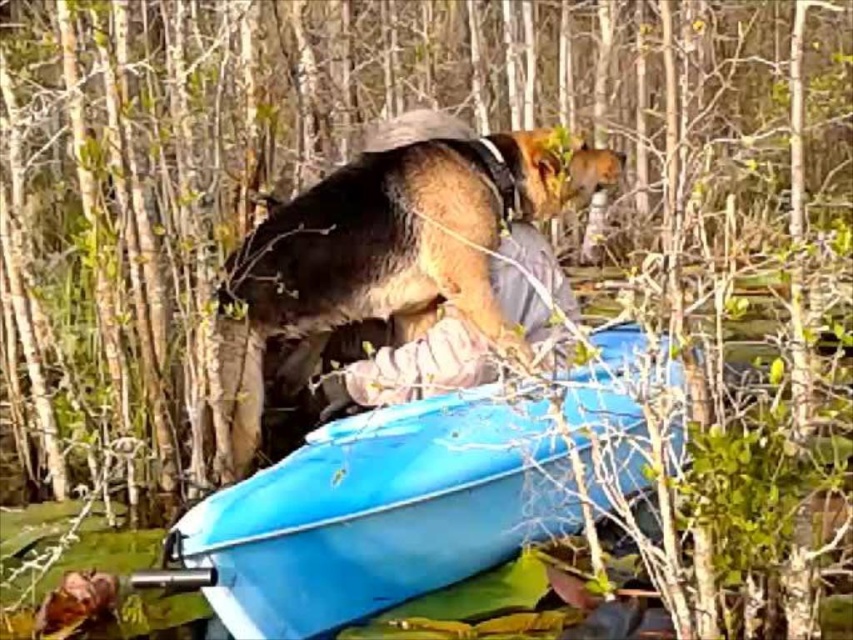
You are a drone operator trying to capture a photo of the blue plastic boat at center. The drone is currently at the point with coordinates point (x=380, y=513). Is the drone positioned directly above the blue plastic boat at center?

The blue plastic boat at center is represented by point (x=380, y=513), so yes, the drone is positioned directly above the blue plastic boat at center.

You are a hiker who wants to take the brown fur dog at center and the blue plastic boat at center with you. Since you need to carry both items, which one should you pick up first if you want to reach the boat first?

The blue plastic boat at center is below the brown fur dog at center, so you should pick up the brown fur dog at center first to access the blue plastic boat at center.

You are a hiker trying to take a photo of the brown fur dog at center and the blue plastic boat at center. Which object should you focus on first if you want both to be in sharp focus?

The blue plastic boat at center is closer to the viewer than the brown fur dog at center. To have both in sharp focus, focus on the brown fur dog at center since it is farther away, as depth of field extends behind the focus point more effectively when focusing on the farther object.